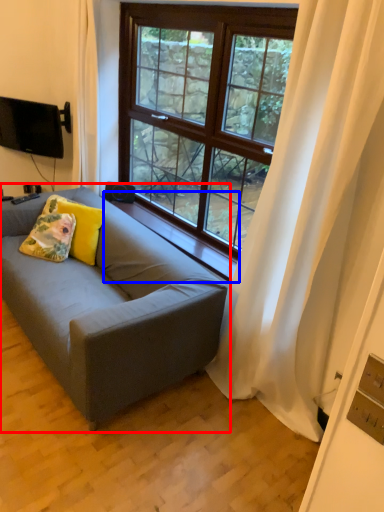
Question: Which object appears farthest to the camera in this image, studio couch (highlighted by a red box) or window sill (highlighted by a blue box)?

Choices:
 (A) studio couch
 (B) window sill

Answer: (B)